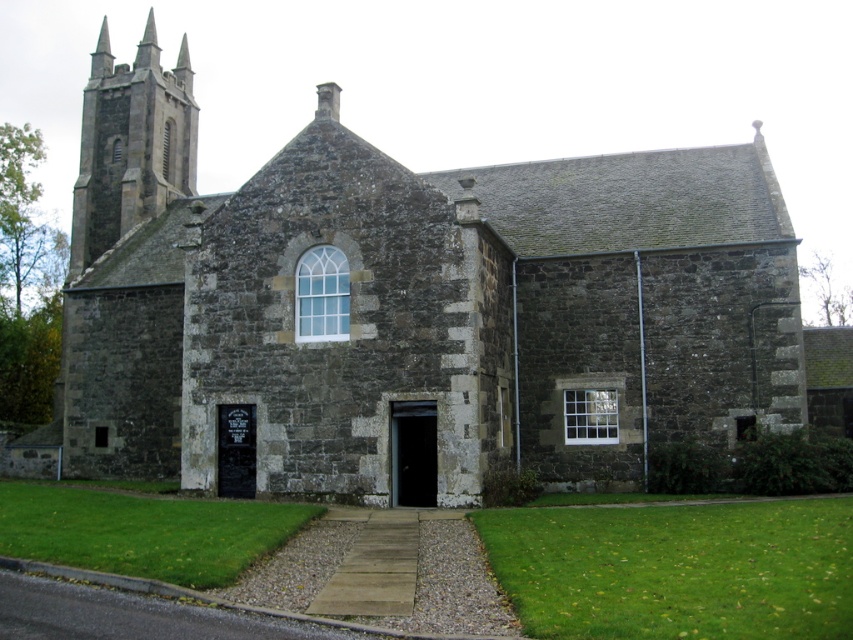
Consider the image. You are standing at the center of a square in front of the dark gray stone church at center. If you walk straight ahead, will you eventually reach the church?

Yes, walking straight ahead from the center of the square will lead you directly to the dark gray stone church at center since it is positioned at the central point of the scene.

You are an architect evaluating the spatial compatibility of a new sculpture. The sculpture is 10 meters wide. You need to place it in front of the dark gray stone church at center and the dark gray stone spire at upper left. Which location would allow the sculpture to fit without appearing too small compared to the structure?

The dark gray stone church at center is wider than the dark gray stone spire at upper left. Since the sculpture is 10 meters wide, placing it in front of the dark gray stone church at center would be more appropriate as the church is wider, ensuring the sculpture doesn not look too small in comparison.